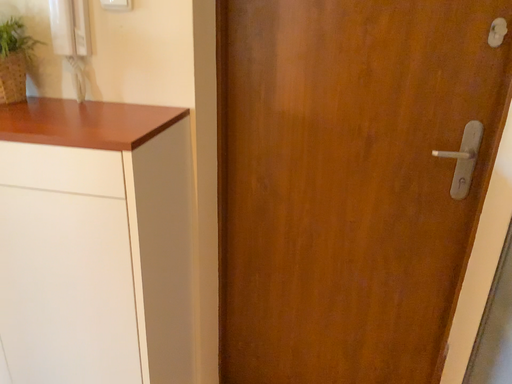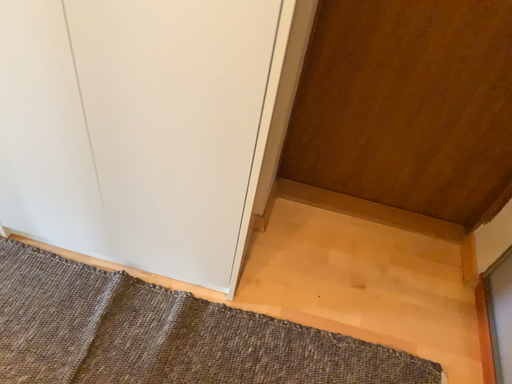
Question: How did the camera likely rotate when shooting the video?

Choices:
 (A) rotated downward
 (B) rotated upward

Answer: (A)